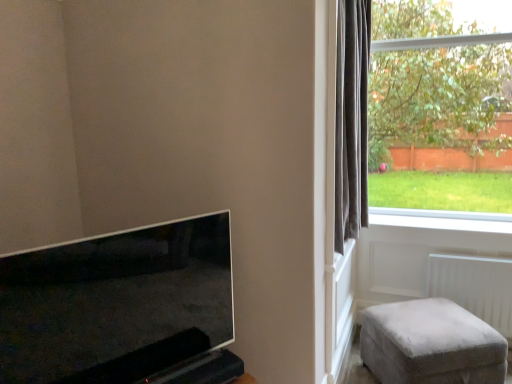
Question: Would you say matte black tv at lower left is a long distance from white smooth window sill at lower right?

Choices:
 (A) yes
 (B) no

Answer: (A)

Question: Considering the relative sizes of matte black tv at lower left and white smooth window sill at lower right in the image provided, is matte black tv at lower left bigger than white smooth window sill at lower right?

Choices:
 (A) yes
 (B) no

Answer: (A)

Question: Is the position of matte black tv at lower left more distant than that of white smooth window sill at lower right?

Choices:
 (A) no
 (B) yes

Answer: (A)

Question: Can you confirm if matte black tv at lower left is taller than white smooth window sill at lower right?

Choices:
 (A) no
 (B) yes

Answer: (B)

Question: Can you confirm if matte black tv at lower left is wider than white smooth window sill at lower right?

Choices:
 (A) yes
 (B) no

Answer: (B)

Question: Is white plastic radiator at lower right inside or outside of matte black tv at lower left?

Choices:
 (A) outside
 (B) inside

Answer: (A)

Question: Is point (454, 266) closer or farther from the camera than point (227, 238)?

Choices:
 (A) farther
 (B) closer

Answer: (A)

Question: From the image's perspective, is white plastic radiator at lower right positioned above or below matte black tv at lower left?

Choices:
 (A) above
 (B) below

Answer: (B)

Question: In the image, is white plastic radiator at lower right positioned in front of or behind matte black tv at lower left?

Choices:
 (A) behind
 (B) front

Answer: (A)

Question: Visually, is white smooth window sill at lower right positioned to the left or to the right of dark grey velvet curtain at right?

Choices:
 (A) left
 (B) right

Answer: (B)

Question: From the image's perspective, is white smooth window sill at lower right positioned above or below dark grey velvet curtain at right?

Choices:
 (A) below
 (B) above

Answer: (A)

Question: From a real-world perspective, is white smooth window sill at lower right physically located above or below dark grey velvet curtain at right?

Choices:
 (A) below
 (B) above

Answer: (A)

Question: Considering the positions of white smooth window sill at lower right and dark grey velvet curtain at right in the image, is white smooth window sill at lower right wider or thinner than dark grey velvet curtain at right?

Choices:
 (A) wide
 (B) thin

Answer: (A)

Question: In the image, is white smooth window sill at lower right on the left side or the right side of white plastic radiator at lower right?

Choices:
 (A) right
 (B) left

Answer: (B)

Question: Relative to white plastic radiator at lower right, is white smooth window sill at lower right in front or behind?

Choices:
 (A) behind
 (B) front

Answer: (A)